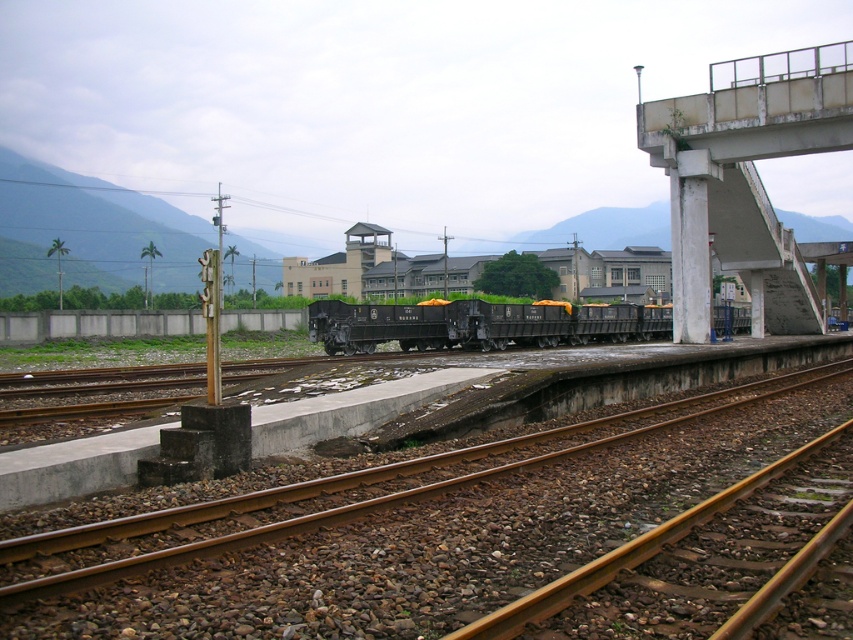
Between point (759, 388) and point (735, 161), which one is positioned in front?

Point (759, 388) is more forward.

Who is taller, brown gravel track at center or concrete bridge at right?

With more height is concrete bridge at right.

This screenshot has height=640, width=853. What do you see at coordinates (419, 532) in the screenshot? I see `brown gravel track at center` at bounding box center [419, 532].

Where is `brown gravel track at center`? The image size is (853, 640). brown gravel track at center is located at coordinates (419, 532).

Between point (700, 314) and point (457, 333), which one is positioned in front?

Positioned in front is point (700, 314).

Is concrete bridge at right positioned at the back of black matte train at center?

No, it is not.

Is point (775, 276) behind point (405, 346)?

No, it is not.

Where is `concrete bridge at right`? This screenshot has width=853, height=640. concrete bridge at right is located at coordinates (746, 180).

Does brown gravel track at center have a larger size compared to black matte train at center?

Incorrect, brown gravel track at center is not larger than black matte train at center.

Is point (817, 403) positioned behind point (379, 305)?

No, (817, 403) is in front of (379, 305).

You are a GUI agent. You are given a task and a screenshot of the screen. Output one action in this format:
    pyautogui.click(x=<x>, y=<y>)
    Task: Click on the brown gravel track at center
    
    Given the screenshot: What is the action you would take?
    pyautogui.click(x=419, y=532)